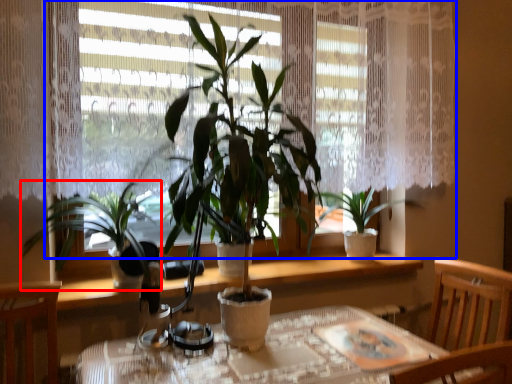
Question: Which point is closer to the camera, houseplant (highlighted by a red box) or window (highlighted by a blue box)?

Choices:
 (A) houseplant
 (B) window

Answer: (A)